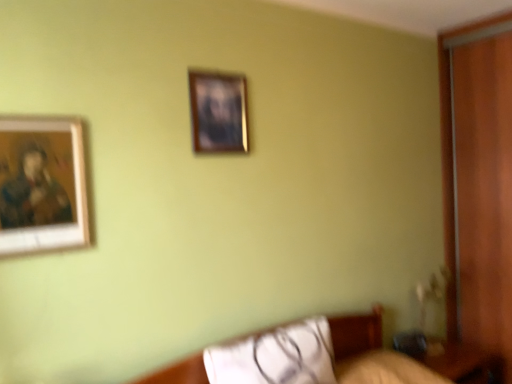
Question: From the image's perspective, is wooden-framed painting at left, which is the 1th picture frame in bottom-to-top order, positioned above or below white fabric pillow at lower center?

Choices:
 (A) above
 (B) below

Answer: (A)

Question: Is point (28, 155) positioned closer to the camera than point (294, 347)?

Choices:
 (A) closer
 (B) farther

Answer: (A)

Question: Which object is the farthest from the wooden frame at upper center, which is the first picture frame from top to bottom?

Choices:
 (A) wooden-framed painting at left, acting as the 2th picture frame starting from the back
 (B) wooden table at lower right
 (C) white fabric pillow at lower center

Answer: (B)

Question: Estimate the real-world distances between objects in this image. Which object is closer to the wooden table at lower right?

Choices:
 (A) wooden frame at upper center, arranged as the first picture frame when viewed from the back
 (B) white fabric pillow at lower center
 (C) wooden-framed painting at left, the 2th picture frame when ordered from top to bottom

Answer: (B)